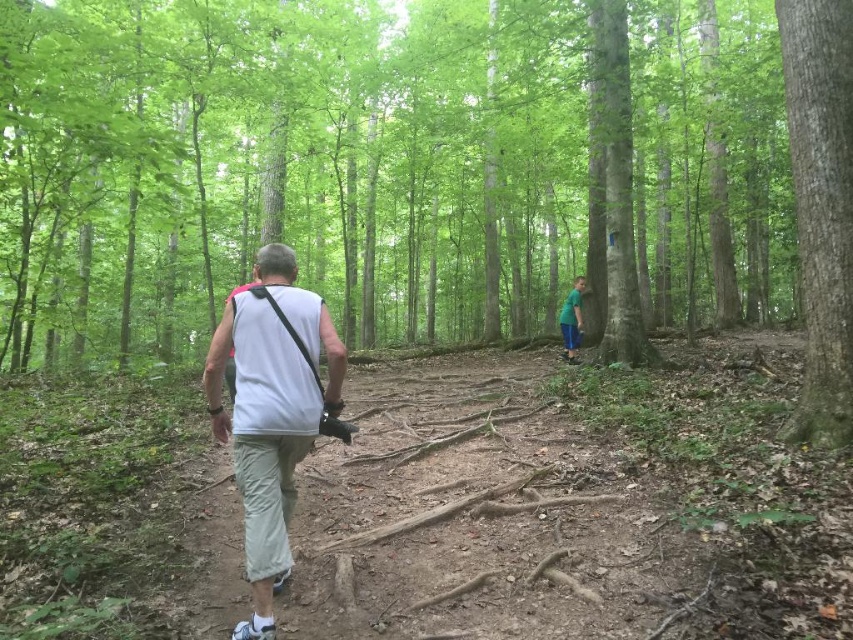
Does white fabric shirt at center have a lesser width compared to smooth bark tree at right?

Incorrect, white fabric shirt at center's width is not less than smooth bark tree at right's.

Can you confirm if white fabric shirt at center is smaller than smooth bark tree at right?

Correct, white fabric shirt at center occupies less space than smooth bark tree at right.

I want to click on white fabric shirt at center, so click(271, 413).

Which of these two, smooth bark tree at center or smooth bark tree at right, stands taller?

With more height is smooth bark tree at center.

How far apart are smooth bark tree at center and smooth bark tree at right?

The distance of smooth bark tree at center from smooth bark tree at right is 29.42 feet.

The image size is (853, 640). What do you see at coordinates (430, 172) in the screenshot?
I see `smooth bark tree at center` at bounding box center [430, 172].

The height and width of the screenshot is (640, 853). What are the coordinates of `smooth bark tree at center` in the screenshot? It's located at (430, 172).

Which is above, white fabric shirt at center or green fabric shirt at center?

green fabric shirt at center is higher up.

Is white fabric shirt at center shorter than green fabric shirt at center?

No, white fabric shirt at center is not shorter than green fabric shirt at center.

Measure the distance between point (259, 307) and camera.

The distance of point (259, 307) from camera is 2.46 meters.

Where is `white fabric shirt at center`? The image size is (853, 640). white fabric shirt at center is located at coordinates (271, 413).